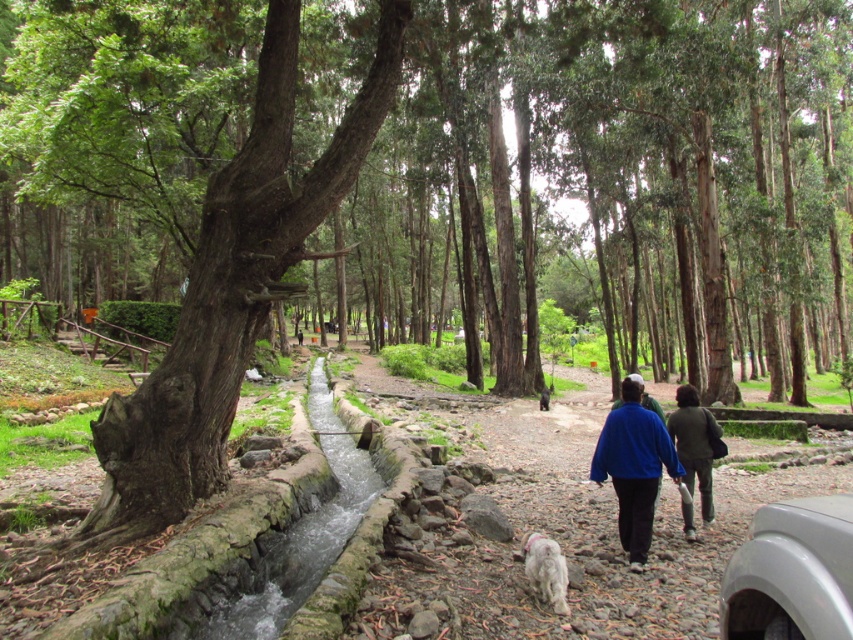
Question: Does dark green fabric jacket at center-right have a larger size compared to white fluffy dog at center?

Choices:
 (A) yes
 (B) no

Answer: (A)

Question: Which point is closer to the camera taking this photo?

Choices:
 (A) (543, 392)
 (B) (595, 449)
 (C) (158, 257)
 (D) (715, 426)

Answer: (D)

Question: Considering the relative positions of green rough bark tree at center and gray matte car at lower right in the image provided, where is green rough bark tree at center located with respect to gray matte car at lower right?

Choices:
 (A) left
 (B) right

Answer: (B)

Question: In this image, where is white fluffy dog at center located relative to white fur dog at center?

Choices:
 (A) below
 (B) above

Answer: (B)

Question: Among these objects, which one is nearest to the camera?

Choices:
 (A) white fur dog at center
 (B) green mossy log at left
 (C) gray matte car at lower right
 (D) blue fleece jacket at center

Answer: (C)

Question: Which point appears closest to the camera in this image?

Choices:
 (A) (529, 548)
 (B) (704, 465)
 (C) (119, 83)

Answer: (A)